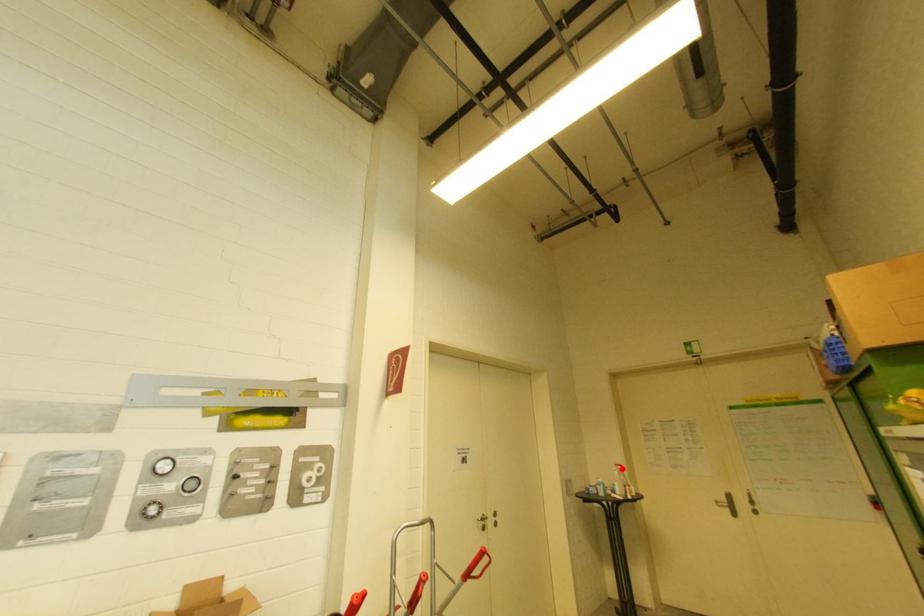
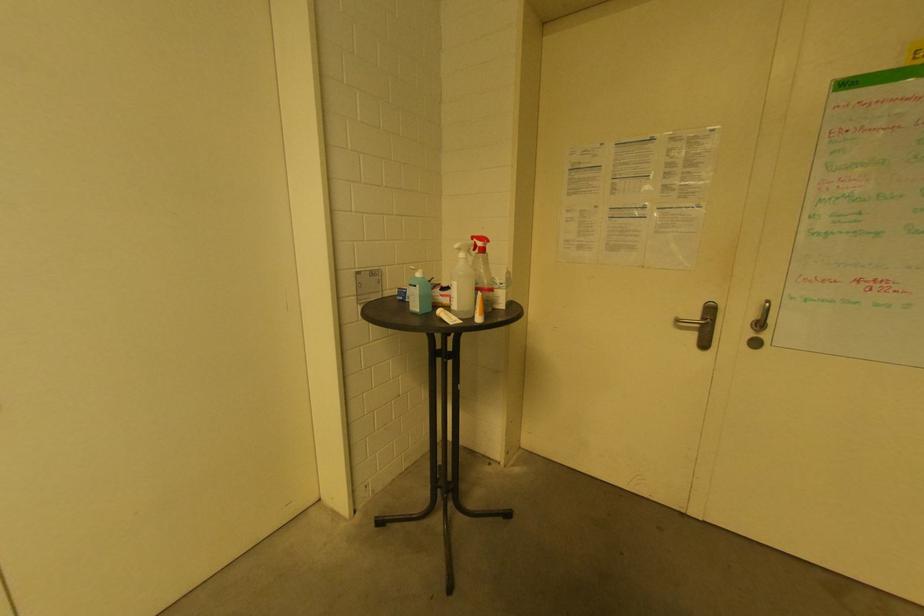
In the second image, find the point that corresponds to the highlighted location in the first image.

(481, 245)